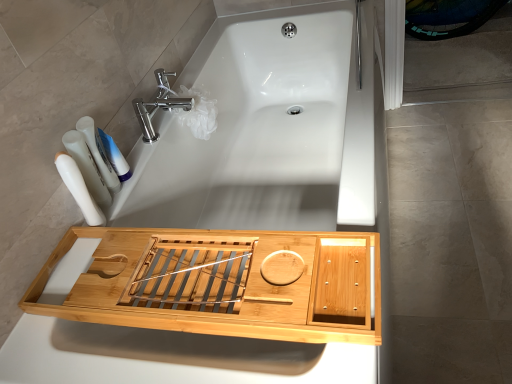
Image resolution: width=512 pixels, height=384 pixels. What are the coordinates of `free location in front of white plastic bottles at left, which appears as the 3th toiletry when viewed from the back` in the screenshot? It's located at (78, 276).